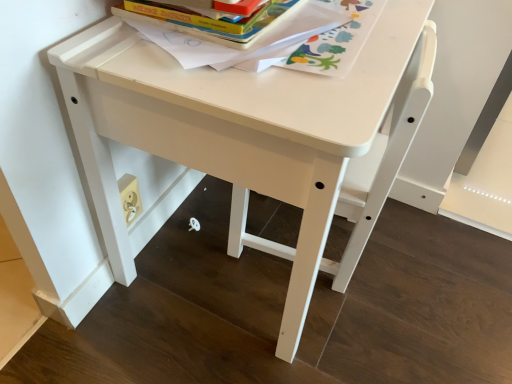
Question: Should I look upward or downward to see hardcover book at upper center?

Choices:
 (A) down
 (B) up

Answer: (B)

Question: Is hardcover book at upper center touching hardcover book at upper center?

Choices:
 (A) no
 (B) yes

Answer: (B)

Question: Is hardcover book at upper center to the right of hardcover book at upper center from the viewer's perspective?

Choices:
 (A) no
 (B) yes

Answer: (B)

Question: Is hardcover book at upper center thinner than hardcover book at upper center?

Choices:
 (A) no
 (B) yes

Answer: (A)

Question: Is hardcover book at upper center smaller than hardcover book at upper center?

Choices:
 (A) yes
 (B) no

Answer: (B)

Question: Is hardcover book at upper center not near hardcover book at upper center?

Choices:
 (A) yes
 (B) no

Answer: (B)

Question: Considering the relative sizes of hardcover book at upper center and hardcover book at upper center in the image provided, is hardcover book at upper center bigger than hardcover book at upper center?

Choices:
 (A) yes
 (B) no

Answer: (A)

Question: Does hardcover book at upper center have a larger size compared to white plastic chair at center?

Choices:
 (A) yes
 (B) no

Answer: (B)

Question: From the image's perspective, would you say hardcover book at upper center is positioned over white plastic chair at center?

Choices:
 (A) no
 (B) yes

Answer: (B)

Question: Is white plastic chair at center a part of hardcover book at upper center?

Choices:
 (A) no
 (B) yes

Answer: (A)

Question: Is hardcover book at upper center taller than white plastic chair at center?

Choices:
 (A) yes
 (B) no

Answer: (B)

Question: Is hardcover book at upper center with white plastic chair at center?

Choices:
 (A) yes
 (B) no

Answer: (B)

Question: Would you say hardcover book at upper center is a long distance from white plastic chair at center?

Choices:
 (A) no
 (B) yes

Answer: (A)

Question: Is hardcover book at upper center next to white plastic chair at center and touching it?

Choices:
 (A) yes
 (B) no

Answer: (B)